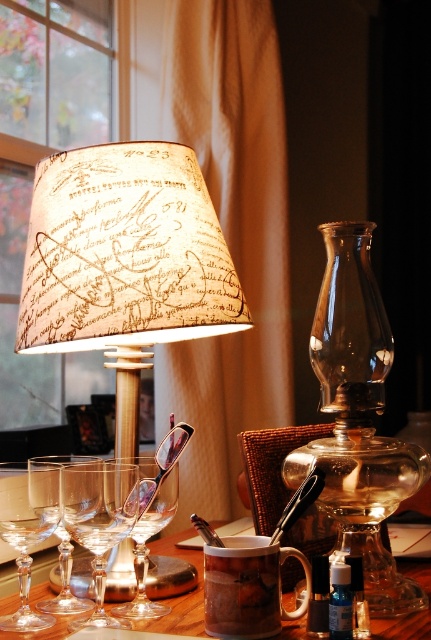
Does wooden table at center have a lesser width compared to shiny metal spoon at upper center?

In fact, wooden table at center might be wider than shiny metal spoon at upper center.

Is wooden table at center shorter than shiny metal spoon at upper center?

Yes.

Is point (59, 620) farther from camera compared to point (294, 513)?

Yes, it is.

Find the location of a particular element. wooden table at center is located at coordinates (180, 595).

Which is below, clear glass wine glass at lower left or silver polished spoon at center?

clear glass wine glass at lower left

The image size is (431, 640). What do you see at coordinates (65, 580) in the screenshot?
I see `clear glass wine glass at lower left` at bounding box center [65, 580].

Is point (66, 545) behind point (211, 531)?

Yes.

Image resolution: width=431 pixels, height=640 pixels. Find the location of `clear glass wine glass at lower left`. clear glass wine glass at lower left is located at coordinates (65, 580).

Who is positioned more to the right, transparent glass oil lamp at right or clear glass wine glass at lower left?

Positioned to the right is transparent glass oil lamp at right.

Locate an element on the screen. transparent glass oil lamp at right is located at coordinates (358, 419).

The width and height of the screenshot is (431, 640). I want to click on transparent glass oil lamp at right, so click(x=358, y=419).

Locate an element on the screen. The image size is (431, 640). transparent glass oil lamp at right is located at coordinates (358, 419).